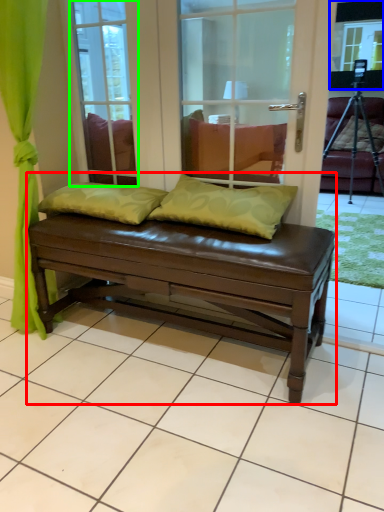
Question: Considering the real-world distances, which object is farthest from studio couch (highlighted by a red box)? window screen (highlighted by a blue box) or glass door (highlighted by a green box)?

Choices:
 (A) window screen
 (B) glass door

Answer: (A)